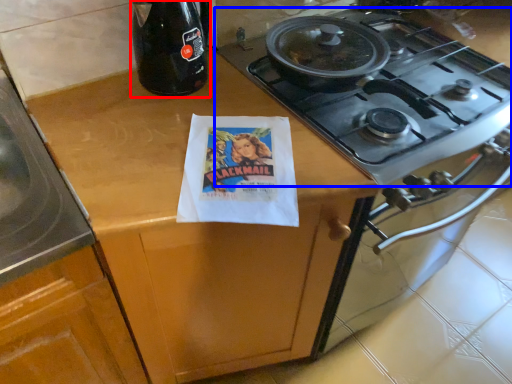
Question: Which of the following is the closest to the observer, bottle (highlighted by a red box) or gas stove (highlighted by a blue box)?

Choices:
 (A) bottle
 (B) gas stove

Answer: (B)